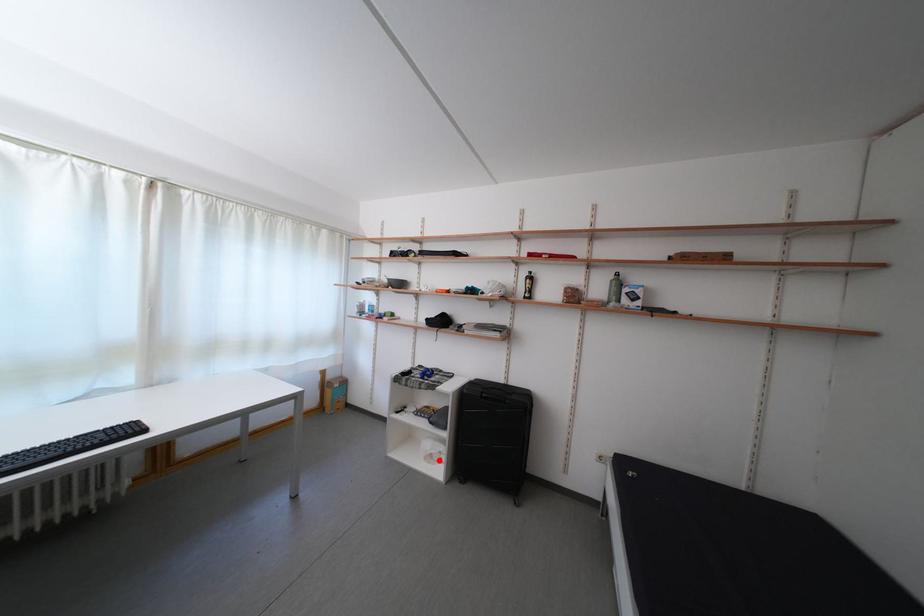
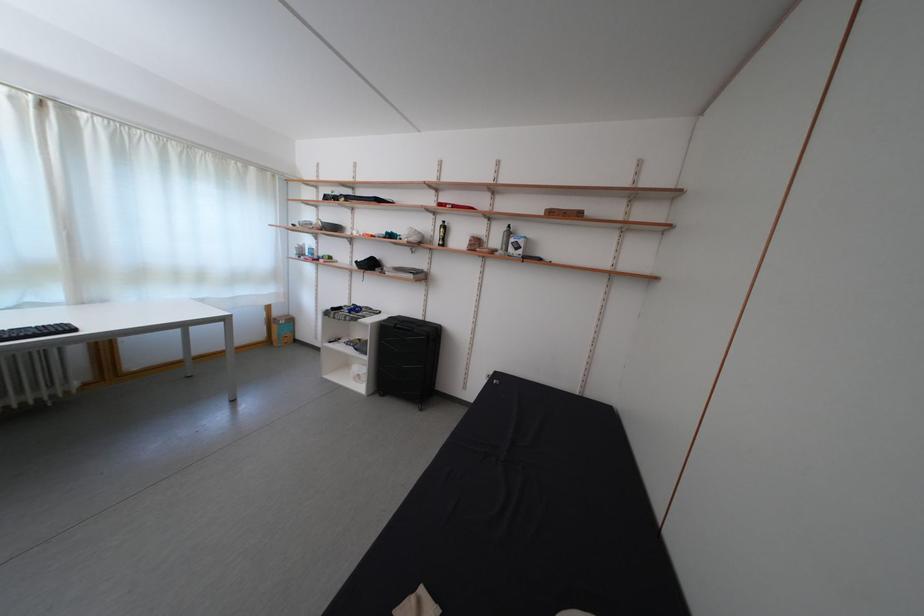
The point at the highlighted location is marked in the first image. Where is the corresponding point in the second image?

(365, 381)